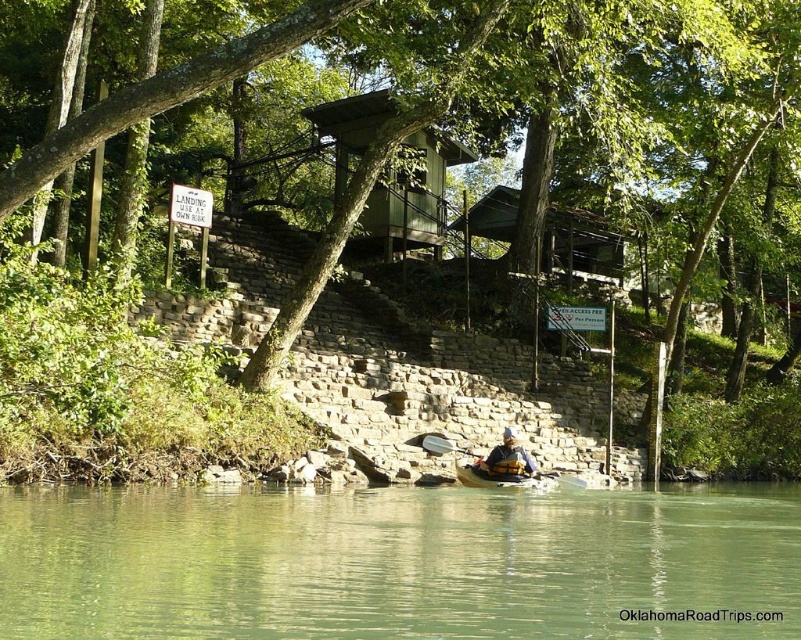
Question: Which point is farther from the camera taking this photo?

Choices:
 (A) (502, 470)
 (B) (497, 476)

Answer: (A)

Question: Does green translucent water at lower center appear over yellow life vest at center?

Choices:
 (A) no
 (B) yes

Answer: (A)

Question: Which point appears closest to the camera in this image?

Choices:
 (A) (180, 500)
 (B) (522, 460)

Answer: (A)

Question: Is wooden paddle at center closer to camera compared to yellow life vest at center?

Choices:
 (A) no
 (B) yes

Answer: (B)

Question: Is green translucent water at lower center to the left of wooden paddle at center from the viewer's perspective?

Choices:
 (A) yes
 (B) no

Answer: (A)

Question: Which point is farther from the camera taking this photo?

Choices:
 (A) (488, 461)
 (B) (421, 440)
 (C) (548, 474)
 (D) (75, 506)

Answer: (C)